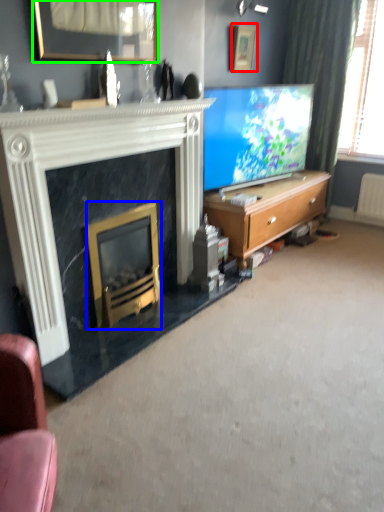
Question: Which object is positioned farthest from picture frame (highlighted by a red box)? Select from fireplace (highlighted by a blue box) and picture frame (highlighted by a green box).

Choices:
 (A) fireplace
 (B) picture frame

Answer: (A)